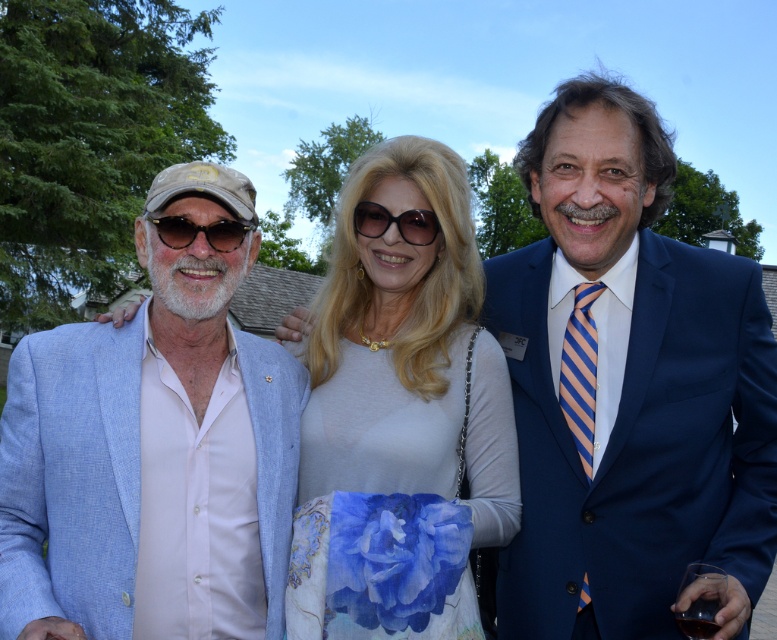
Question: Does blue silk suit at center appear on the left side of light blue linen suit at left?

Choices:
 (A) no
 (B) yes

Answer: (A)

Question: Which object is the farthest from the black plastic sunglasses at center?

Choices:
 (A) white silk blouse at center
 (B) light blue linen suit at left

Answer: (B)

Question: Observing the image, what is the correct spatial positioning of light blue linen suit at left in reference to white silk blouse at center?

Choices:
 (A) right
 (B) left

Answer: (B)

Question: Which point is farther to the camera?

Choices:
 (A) blue silk suit at center
 (B) transparent glass at center
 (C) white silk blouse at center

Answer: (A)

Question: Which of the following is the closest to the observer?

Choices:
 (A) (413, 164)
 (B) (173, 612)
 (C) (692, 589)
 (D) (368, 230)

Answer: (C)

Question: Considering the relative positions of white silk blouse at center and matte black sunglasses at left in the image provided, where is white silk blouse at center located with respect to matte black sunglasses at left?

Choices:
 (A) left
 (B) right

Answer: (B)